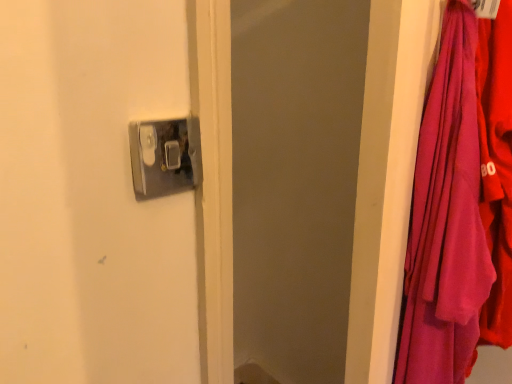
Question: In the image, is purple fabric at right positioned in front of or behind metallic silver door handle at upper center?

Choices:
 (A) front
 (B) behind

Answer: (A)

Question: Is purple fabric at right to the left or to the right of metallic silver door handle at upper center in the image?

Choices:
 (A) right
 (B) left

Answer: (A)

Question: Is purple fabric at right bigger or smaller than metallic silver door handle at upper center?

Choices:
 (A) small
 (B) big

Answer: (B)

Question: From a real-world perspective, is metallic silver door handle at upper center physically located above or below purple fabric at right?

Choices:
 (A) above
 (B) below

Answer: (A)

Question: From the image's perspective, relative to purple fabric at right, is metallic silver door handle at upper center above or below?

Choices:
 (A) below
 (B) above

Answer: (B)

Question: Would you say metallic silver door handle at upper center is to the left or to the right of purple fabric at right in the picture?

Choices:
 (A) right
 (B) left

Answer: (B)

Question: Is metallic silver door handle at upper center situated inside purple fabric at right or outside?

Choices:
 (A) inside
 (B) outside

Answer: (B)